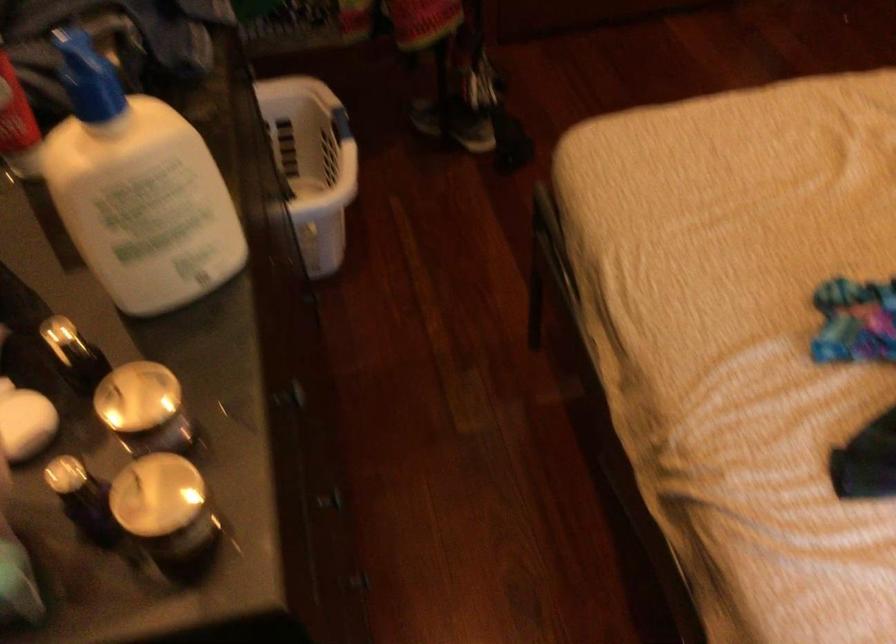
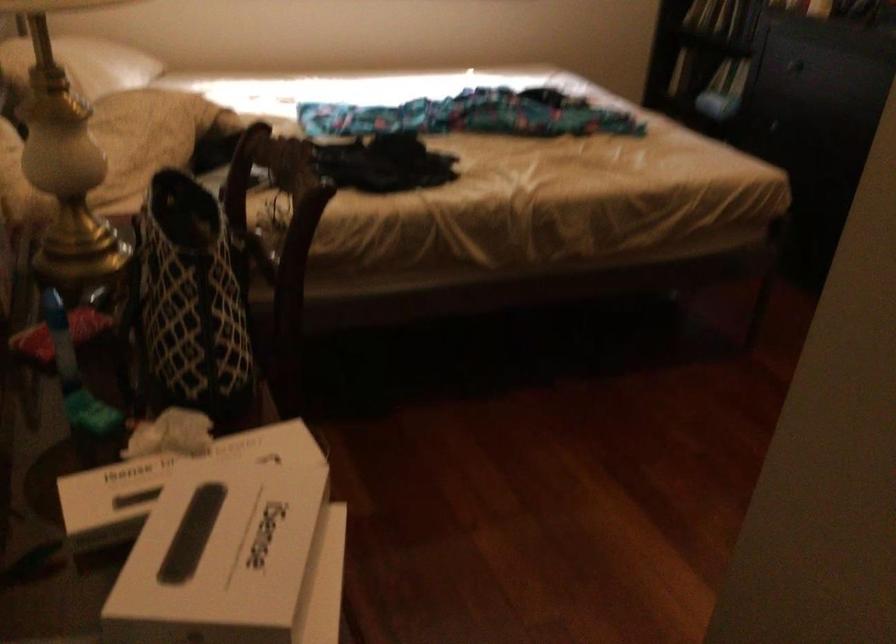
Question: I am providing you with two images of the same scene from different viewpoints. Which of the following objects are not visible in image2?

Choices:
 (A) patterned tote bag
 (B) blue plastic hanger
 (C) white product box
 (D) silver drawer pull

Answer: (D)